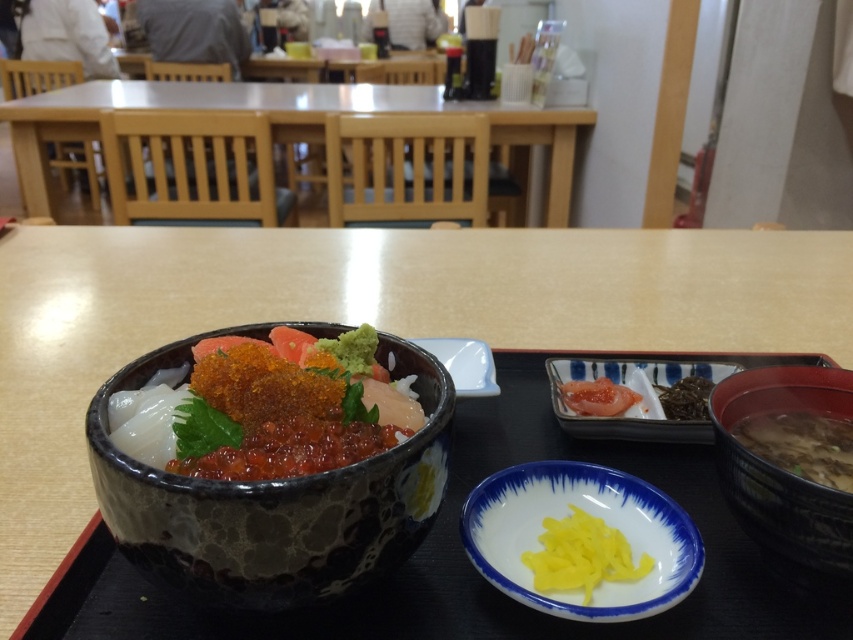
Question: Is yellow shredded ginger at center positioned at the back of smooth pink salmon at center?

Choices:
 (A) no
 (B) yes

Answer: (A)

Question: Which of the following is the farthest from the observer?

Choices:
 (A) yellow shredded ginger at center
 (B) shiny ceramic bowl of sashimi at center
 (C) smooth white plate at center
 (D) brown ceramic bowl at lower right

Answer: (C)

Question: Is brown ceramic bowl at lower right to the left of dark brown seaweed at upper right from the viewer's perspective?

Choices:
 (A) yes
 (B) no

Answer: (A)

Question: Among these objects, which one is farthest from the camera?

Choices:
 (A) speckled ceramic bowl at center
 (B) brown matte soup bowl at lower right
 (C) glossy wood table at upper center
 (D) shiny ceramic bowl of sashimi at center

Answer: (C)

Question: Can you confirm if shiny ceramic bowl of sashimi at center is positioned to the right of brown ceramic bowl at lower right?

Choices:
 (A) yes
 (B) no

Answer: (B)

Question: Which point appears closest to the camera in this image?

Choices:
 (A) (401, 90)
 (B) (648, 308)
 (C) (659, 400)
 (D) (467, 372)

Answer: (C)